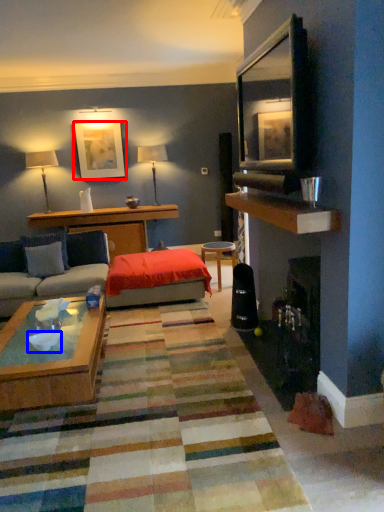
Question: Which point is closer to the camera, picture frame (highlighted by a red box) or bowl (highlighted by a blue box)?

Choices:
 (A) picture frame
 (B) bowl

Answer: (B)